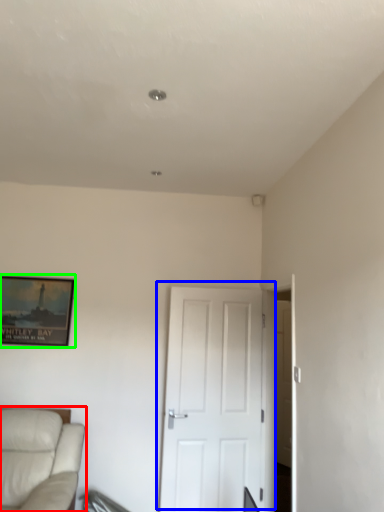
Question: Based on their relative distances, which object is nearer to studio couch (highlighted by a red box)? Choose from door (highlighted by a blue box) and picture frame (highlighted by a green box).

Choices:
 (A) door
 (B) picture frame

Answer: (B)